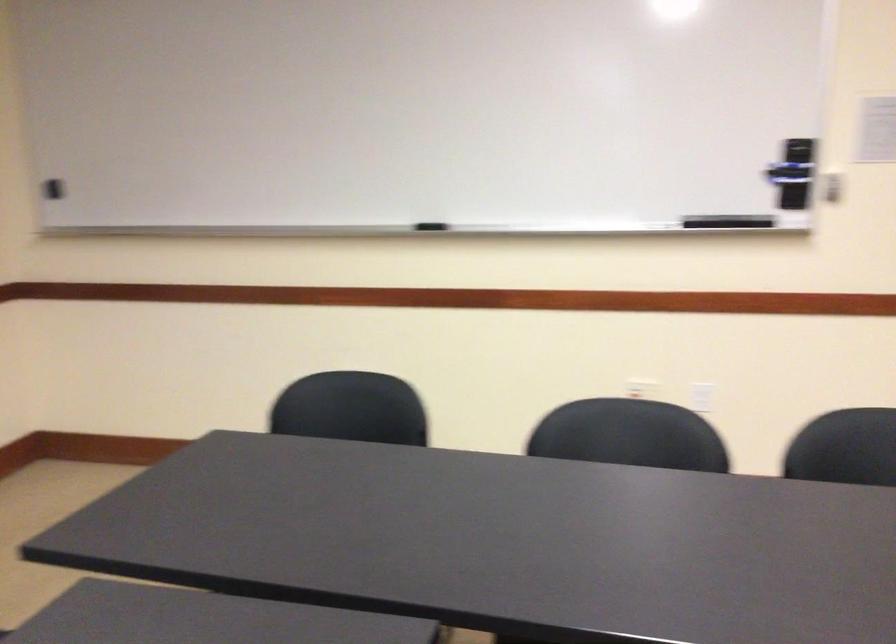
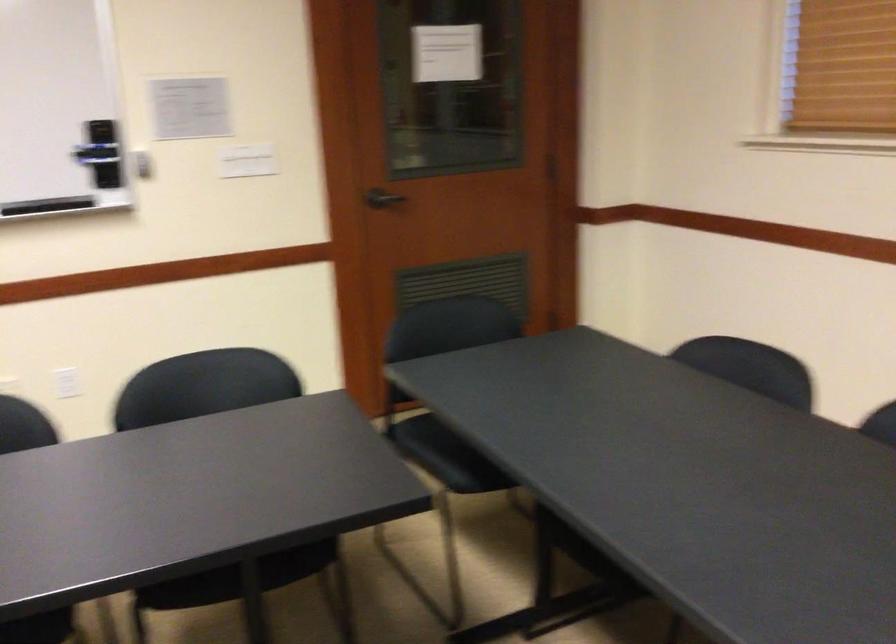
The point at (718, 231) is marked in the first image. Where is the corresponding point in the second image?

(46, 205)